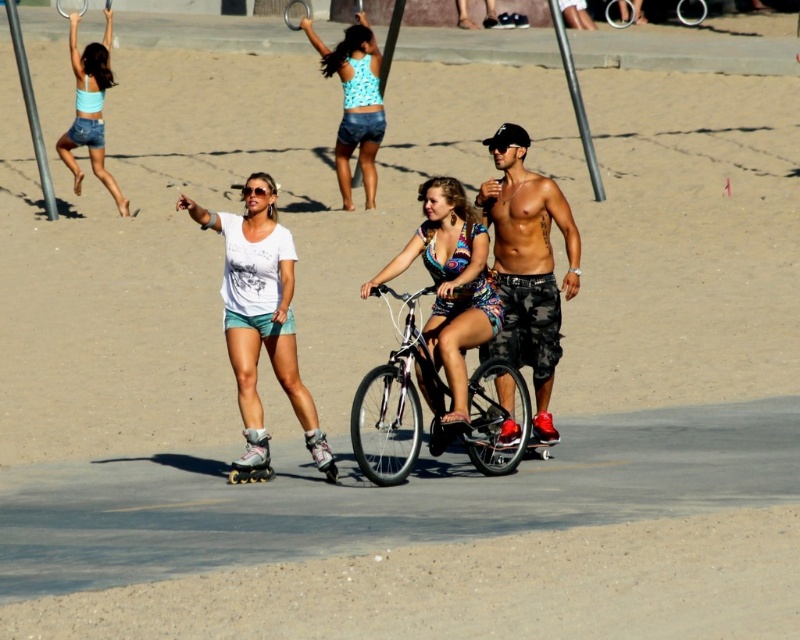
What do you see at coordinates (397, 397) in the screenshot? I see `metallic silver bicycle at center` at bounding box center [397, 397].

Between point (442, 401) and point (350, 205), which one is positioned in front?

Point (442, 401) is more forward.

Where is `metallic silver bicycle at center`? The width and height of the screenshot is (800, 640). metallic silver bicycle at center is located at coordinates (397, 397).

This screenshot has height=640, width=800. What do you see at coordinates (90, 109) in the screenshot? I see `denim shorts at upper left` at bounding box center [90, 109].

Does point (78, 115) come behind point (233, 481)?

Yes, point (78, 115) is farther from viewer.

Is point (60, 136) farther from camera compared to point (272, 472)?

Yes.

Find the location of a particular element. This screenshot has height=640, width=800. denim shorts at upper left is located at coordinates (90, 109).

Does white matte t-shirt at center appear over metallic silver bicycle at center?

Yes, white matte t-shirt at center is above metallic silver bicycle at center.

Who is shorter, white matte t-shirt at center or metallic silver bicycle at center?

metallic silver bicycle at center

Which is in front, point (202, 228) or point (374, 468)?

Point (374, 468) is in front.

Find the location of a particular element. The image size is (800, 640). white matte t-shirt at center is located at coordinates (258, 312).